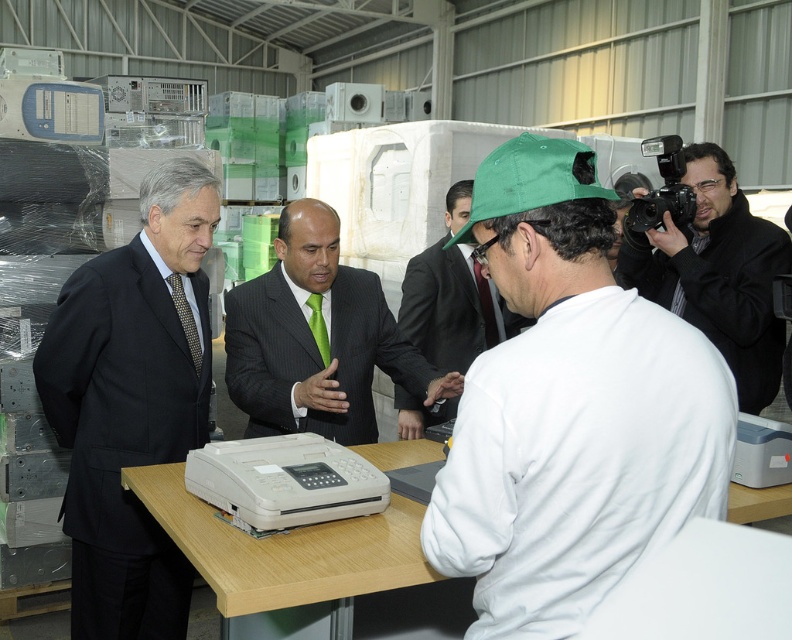
Question: Is black suit at left smaller than white matte cap at center?

Choices:
 (A) no
 (B) yes

Answer: (B)

Question: Among these objects, which one is nearest to the camera?

Choices:
 (A) white matte shirt at center
 (B) black glossy camera at upper right

Answer: (A)

Question: Does green pinstripe suit at center come in front of black glossy camera at upper right?

Choices:
 (A) no
 (B) yes

Answer: (B)

Question: Which point is closer to the camera?

Choices:
 (A) (748, 385)
 (B) (295, 440)
 (C) (288, 257)

Answer: (B)

Question: Is black glossy camera at upper right closer to the viewer compared to beige wood table at center?

Choices:
 (A) no
 (B) yes

Answer: (A)

Question: Which of the following is the closest to the observer?

Choices:
 (A) (756, 310)
 (B) (271, 387)
 (C) (455, 269)
 (D) (596, 445)

Answer: (D)